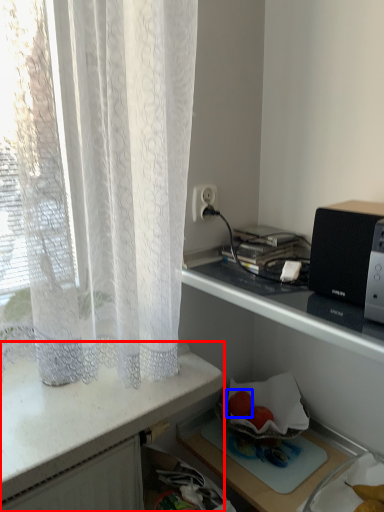
Question: Which point is further to the camera, desk (highlighted by a red box) or fruit (highlighted by a blue box)?

Choices:
 (A) desk
 (B) fruit

Answer: (B)